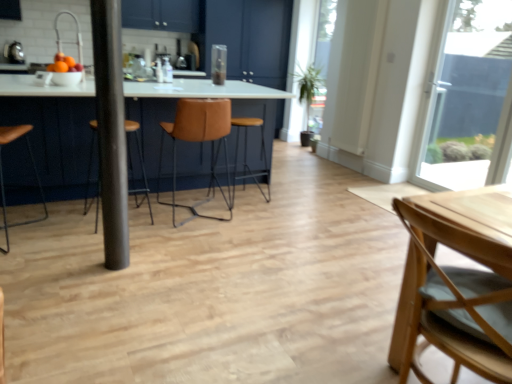
Question: Does point (102, 1) appear closer or farther from the camera than point (271, 89)?

Choices:
 (A) farther
 (B) closer

Answer: (B)

Question: Would you say metallic pole at center is to the left or to the right of matte white table at center in the picture?

Choices:
 (A) left
 (B) right

Answer: (B)

Question: Which object is the farthest from the leather seat at center?

Choices:
 (A) shiny orange fruits at left
 (B) light wood chair at lower right, the 4th chair when ordered from left to right
 (C) matte dark blue cabinet at center
 (D) brown leather stool at center, acting as the 3th chair starting from the right
 (E) transparent glass window at upper right

Answer: (E)

Question: Which of these objects is positioned closest to the matte white table at center?

Choices:
 (A) shiny orange fruits at left
 (B) brown leather stool at center, acting as the 3th chair starting from the right
 (C) metallic pole at center
 (D) leather at center, which ranks as the second chair in right-to-left order
 (E) transparent glass window at upper right

Answer: (D)